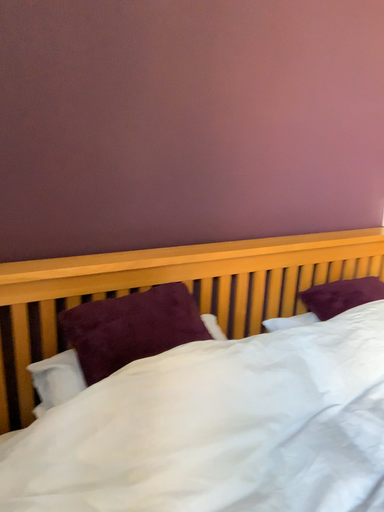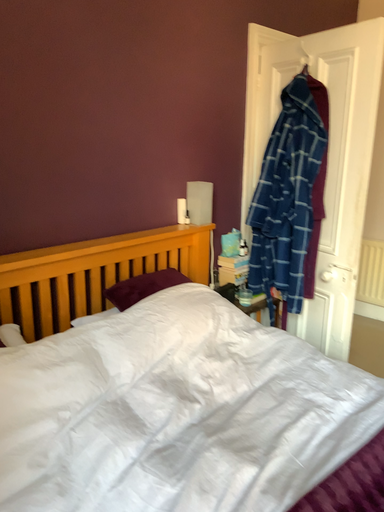
Question: Which way did the camera rotate in the video?

Choices:
 (A) rotated left
 (B) rotated right

Answer: (B)